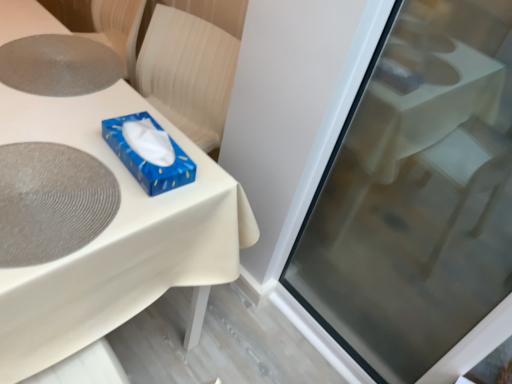
This screenshot has width=512, height=384. Describe the element at coordinates (149, 152) in the screenshot. I see `blue glossy tissue box at upper center` at that location.

The height and width of the screenshot is (384, 512). What do you see at coordinates (86, 367) in the screenshot?
I see `white glossy table at center` at bounding box center [86, 367].

Image resolution: width=512 pixels, height=384 pixels. I want to click on gray textured placemat at upper left, which is the second oval in front-to-back order, so click(x=59, y=65).

At what (x,y) coordinates should I click in order to perform the action: click on matte gray placemat at upper left, which is the first oval from front to back. Please return your answer as a coordinate pair (x, y). Looking at the image, I should click on (51, 201).

Is blue glossy tissue box at upper center completely or partially outside of matte gray placemat at upper left, which is counted as the second oval, starting from the top?

Yes.

Does blue glossy tissue box at upper center have a larger size compared to matte gray placemat at upper left, which is the first oval from front to back?

Indeed, blue glossy tissue box at upper center has a larger size compared to matte gray placemat at upper left, which is the first oval from front to back.

From the image's perspective, which is below, blue glossy tissue box at upper center or matte gray placemat at upper left, marked as the 2th oval in a back-to-front arrangement?

matte gray placemat at upper left, marked as the 2th oval in a back-to-front arrangement, is shown below in the image.

Can you tell me how much blue glossy tissue box at upper center and matte gray placemat at upper left, the first oval in the bottom-to-top sequence, differ in facing direction?

89.6 degrees.

Based on the photo, are gray textured placemat at upper left, the 1th oval in the top-to-bottom sequence, and matte gray placemat at upper left, marked as the 2th oval in a back-to-front arrangement, far apart?

No, gray textured placemat at upper left, the 1th oval in the top-to-bottom sequence, is in close proximity to matte gray placemat at upper left, marked as the 2th oval in a back-to-front arrangement.

Can you tell me how much gray textured placemat at upper left, which is the second oval in front-to-back order, and matte gray placemat at upper left, marked as the 2th oval in a back-to-front arrangement, differ in facing direction?

gray textured placemat at upper left, which is the second oval in front-to-back order, and matte gray placemat at upper left, marked as the 2th oval in a back-to-front arrangement, are facing 92.8 degrees away from each other.

Can you confirm if gray textured placemat at upper left, the 1th oval in the top-to-bottom sequence, is taller than matte gray placemat at upper left, which is counted as the second oval, starting from the top?

Indeed, gray textured placemat at upper left, the 1th oval in the top-to-bottom sequence, has a greater height compared to matte gray placemat at upper left, which is counted as the second oval, starting from the top.

From a real-world perspective, between gray textured placemat at upper left, placed as the 2th oval when sorted from bottom to top, and matte gray placemat at upper left, which is counted as the second oval, starting from the top, who is vertically higher?

matte gray placemat at upper left, which is counted as the second oval, starting from the top.

Is blue glossy tissue box at upper center looking in the opposite direction of white glossy table at center?

No, blue glossy tissue box at upper center is not facing away from white glossy table at center.

How different are the orientations of blue glossy tissue box at upper center and white glossy table at center in degrees?

The angular difference between blue glossy tissue box at upper center and white glossy table at center is 4.41 degrees.

From a real-world perspective, relative to white glossy table at center, is blue glossy tissue box at upper center vertically above or below?

Clearly, from a real-world perspective, blue glossy tissue box at upper center is above white glossy table at center.

Considering the relative sizes of blue glossy tissue box at upper center and white glossy table at center in the image provided, is blue glossy tissue box at upper center bigger than white glossy table at center?

No, blue glossy tissue box at upper center is not bigger than white glossy table at center.

Measure the distance from white glossy table at center to matte gray placemat at upper left, the first oval in the bottom-to-top sequence.

The distance of white glossy table at center from matte gray placemat at upper left, the first oval in the bottom-to-top sequence, is 4.12 inches.

From a real-world perspective, is white glossy table at center over matte gray placemat at upper left, marked as the 2th oval in a back-to-front arrangement?

Incorrect, from a real-world perspective, white glossy table at center is lower than matte gray placemat at upper left, marked as the 2th oval in a back-to-front arrangement.

Between point (84, 351) and point (94, 207), which one is positioned in front?

The point (94, 207) is in front.

From the image's perspective, is matte gray placemat at upper left, which is the first oval from front to back, located above transparent glass screen door at upper right?

Indeed, from the image's perspective, matte gray placemat at upper left, which is the first oval from front to back, is shown above transparent glass screen door at upper right.

Considering the sizes of objects matte gray placemat at upper left, marked as the 2th oval in a back-to-front arrangement, and transparent glass screen door at upper right in the image provided, who is thinner, matte gray placemat at upper left, marked as the 2th oval in a back-to-front arrangement, or transparent glass screen door at upper right?

transparent glass screen door at upper right.

Based on the photo, considering the relative sizes of matte gray placemat at upper left, marked as the 2th oval in a back-to-front arrangement, and transparent glass screen door at upper right in the image provided, is matte gray placemat at upper left, marked as the 2th oval in a back-to-front arrangement, shorter than transparent glass screen door at upper right?

Correct, matte gray placemat at upper left, marked as the 2th oval in a back-to-front arrangement, is not as tall as transparent glass screen door at upper right.

Find the location of a particular element. screen door in front of the matte gray placemat at upper left, marked as the 2th oval in a back-to-front arrangement is located at coordinates (416, 197).

From the image's perspective, relative to transparent glass screen door at upper right, is gray textured placemat at upper left, placed as the 2th oval when sorted from bottom to top, above or below?

Clearly, from the image's perspective, gray textured placemat at upper left, placed as the 2th oval when sorted from bottom to top, is above transparent glass screen door at upper right.

Would you say gray textured placemat at upper left, which is the second oval in front-to-back order, is inside or outside transparent glass screen door at upper right?

gray textured placemat at upper left, which is the second oval in front-to-back order, is outside transparent glass screen door at upper right.

Considering the relative sizes of gray textured placemat at upper left, placed as the 2th oval when sorted from bottom to top, and transparent glass screen door at upper right in the image provided, is gray textured placemat at upper left, placed as the 2th oval when sorted from bottom to top, shorter than transparent glass screen door at upper right?

Correct, gray textured placemat at upper left, placed as the 2th oval when sorted from bottom to top, is not as tall as transparent glass screen door at upper right.

From a real-world perspective, does gray textured placemat at upper left, which is the second oval in front-to-back order, stand above transparent glass screen door at upper right?

Yes, from a real-world perspective, gray textured placemat at upper left, which is the second oval in front-to-back order, is above transparent glass screen door at upper right.

Do you think white glossy table at center is within blue glossy tissue box at upper center, or outside of it?

white glossy table at center is located beyond the bounds of blue glossy tissue box at upper center.

Which of these two, white glossy table at center or blue glossy tissue box at upper center, is wider?

Wider between the two is white glossy table at center.

Is white glossy table at center touching blue glossy tissue box at upper center?

white glossy table at center is not next to blue glossy tissue box at upper center, and they're not touching.

Looking at this image, from the image's perspective, is white glossy table at center located above blue glossy tissue box at upper center?

Correct, white glossy table at center appears higher than blue glossy tissue box at upper center in the image.

Where is `box on the right of matte gray placemat at upper left, which is counted as the second oval, starting from the top`? The height and width of the screenshot is (384, 512). box on the right of matte gray placemat at upper left, which is counted as the second oval, starting from the top is located at coordinates (149, 152).

I want to click on oval lying above the matte gray placemat at upper left, the first oval in the bottom-to-top sequence (from the image's perspective), so click(x=59, y=65).

Considering their positions, is matte gray placemat at upper left, the first oval in the bottom-to-top sequence, positioned further to transparent glass screen door at upper right than blue glossy tissue box at upper center?

Among the two, matte gray placemat at upper left, the first oval in the bottom-to-top sequence, is located further to transparent glass screen door at upper right.

Based on their spatial positions, is blue glossy tissue box at upper center or matte gray placemat at upper left, the first oval in the bottom-to-top sequence, further from white glossy table at center?

Based on the image, blue glossy tissue box at upper center appears to be further to white glossy table at center.

Consider the image. Which object lies nearer to the anchor point blue glossy tissue box at upper center, matte gray placemat at upper left, which is the first oval from front to back, or white glossy table at center?

white glossy table at center is positioned closer to the anchor blue glossy tissue box at upper center.

When comparing their distances from transparent glass screen door at upper right, does white glossy table at center or gray textured placemat at upper left, which is the second oval in front-to-back order, seem further?

Among the two, gray textured placemat at upper left, which is the second oval in front-to-back order, is located further to transparent glass screen door at upper right.

Which object lies further to the anchor point white glossy table at center, matte gray placemat at upper left, the first oval in the bottom-to-top sequence, or gray textured placemat at upper left, which is the second oval in front-to-back order?

The object further to white glossy table at center is gray textured placemat at upper left, which is the second oval in front-to-back order.

Which object lies further to the anchor point transparent glass screen door at upper right, matte gray placemat at upper left, marked as the 2th oval in a back-to-front arrangement, or white glossy table at center?

Based on the image, matte gray placemat at upper left, marked as the 2th oval in a back-to-front arrangement, appears to be further to transparent glass screen door at upper right.

From the image, which object appears to be farther from transparent glass screen door at upper right, blue glossy tissue box at upper center or gray textured placemat at upper left, which is the first oval from back to front?

Based on the image, gray textured placemat at upper left, which is the first oval from back to front, appears to be further to transparent glass screen door at upper right.

Which object lies nearer to the anchor point matte gray placemat at upper left, which is the first oval from front to back, gray textured placemat at upper left, which is the second oval in front-to-back order, or transparent glass screen door at upper right?

gray textured placemat at upper left, which is the second oval in front-to-back order, lies closer to matte gray placemat at upper left, which is the first oval from front to back, than the other object.

In order to click on box between gray textured placemat at upper left, which is the first oval from back to front, and matte gray placemat at upper left, which is counted as the second oval, starting from the top, in the vertical direction in this screenshot , I will do `click(149, 152)`.

At what (x,y) coordinates should I click in order to perform the action: click on box between white glossy table at center and transparent glass screen door at upper right in the horizontal direction. Please return your answer as a coordinate pair (x, y). Looking at the image, I should click on (149, 152).

Locate an element on the screen. Image resolution: width=512 pixels, height=384 pixels. oval situated between gray textured placemat at upper left, the 1th oval in the top-to-bottom sequence, and transparent glass screen door at upper right from left to right is located at coordinates (51, 201).

Where is `box between matte gray placemat at upper left, which is counted as the second oval, starting from the top, and transparent glass screen door at upper right from left to right`? box between matte gray placemat at upper left, which is counted as the second oval, starting from the top, and transparent glass screen door at upper right from left to right is located at coordinates (149, 152).